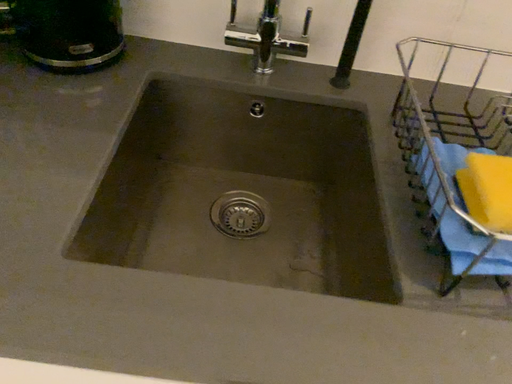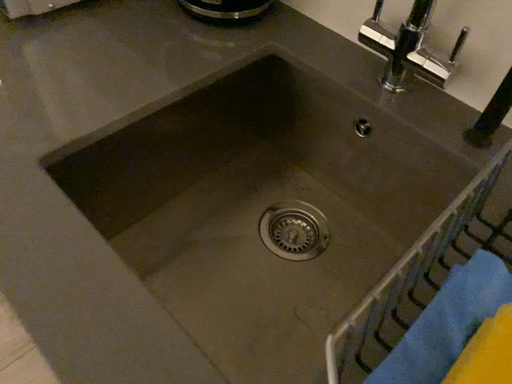
Question: How did the camera likely rotate when shooting the video?

Choices:
 (A) rotated upward
 (B) rotated downward

Answer: (A)